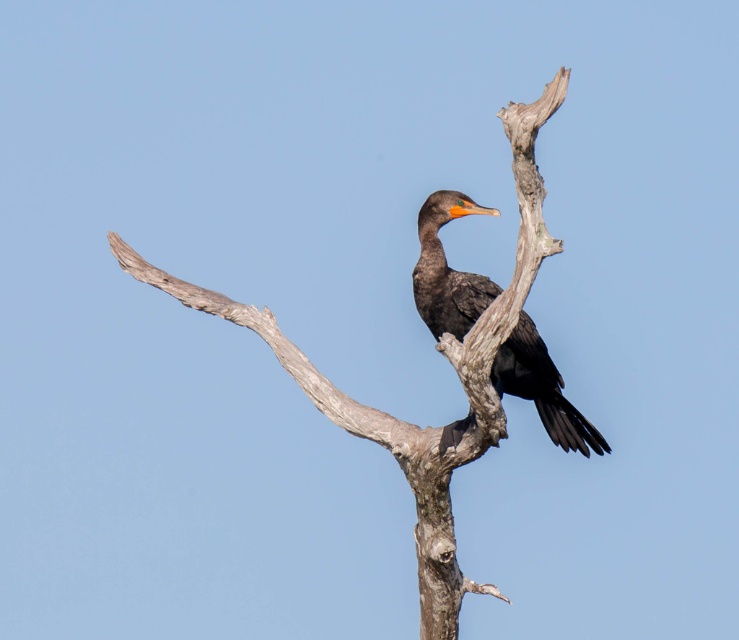
From the picture: Does smooth gray branch at center have a lesser width compared to shiny black bird at center?

No, smooth gray branch at center is not thinner than shiny black bird at center.

Is point (471, 349) more distant than point (528, 330)?

No, it is not.

Between point (449, 518) and point (559, 394), which one is positioned behind?

Point (559, 394)

Find the location of a particular element. The image size is (739, 640). smooth gray branch at center is located at coordinates (439, 353).